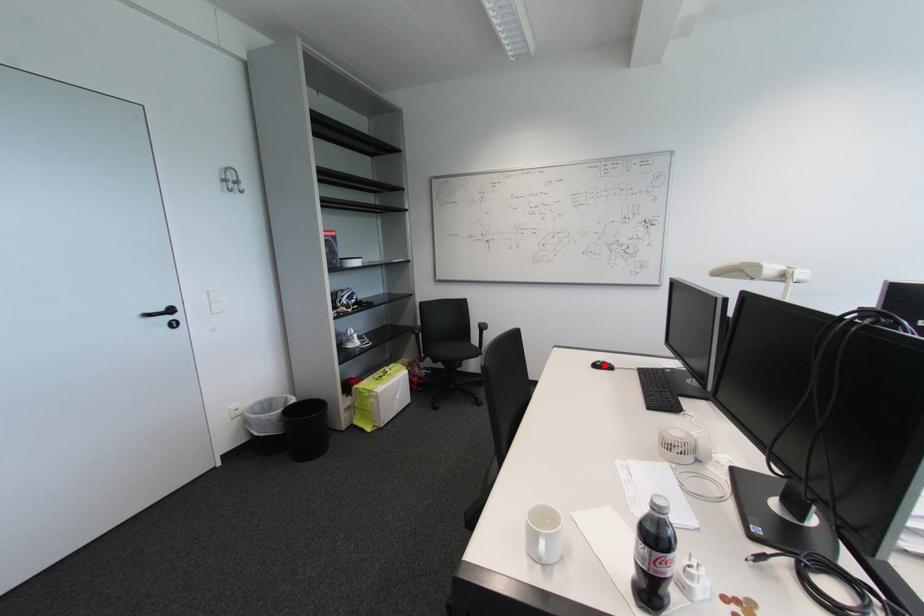
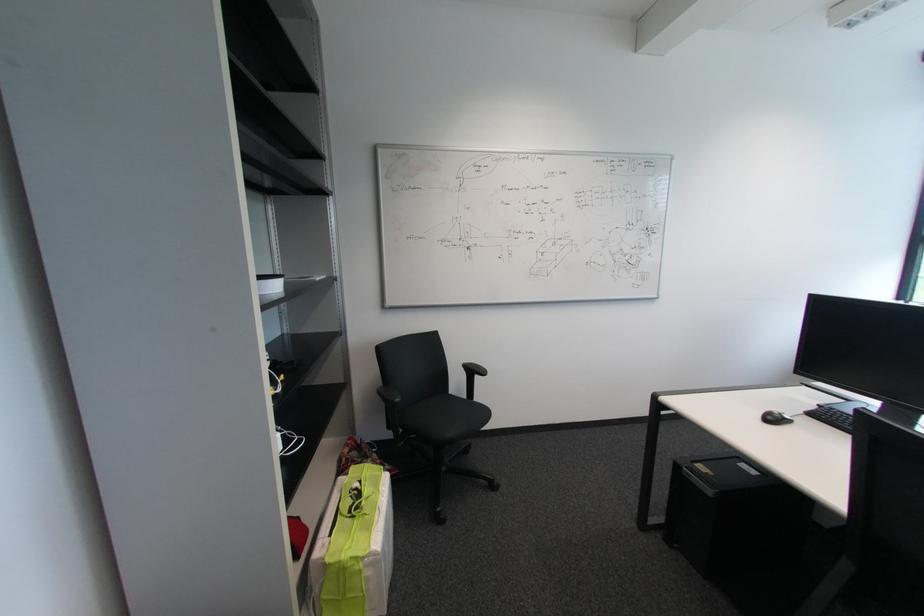
Find the pixel in the second image that matches the highlighted location in the first image.

(775, 418)